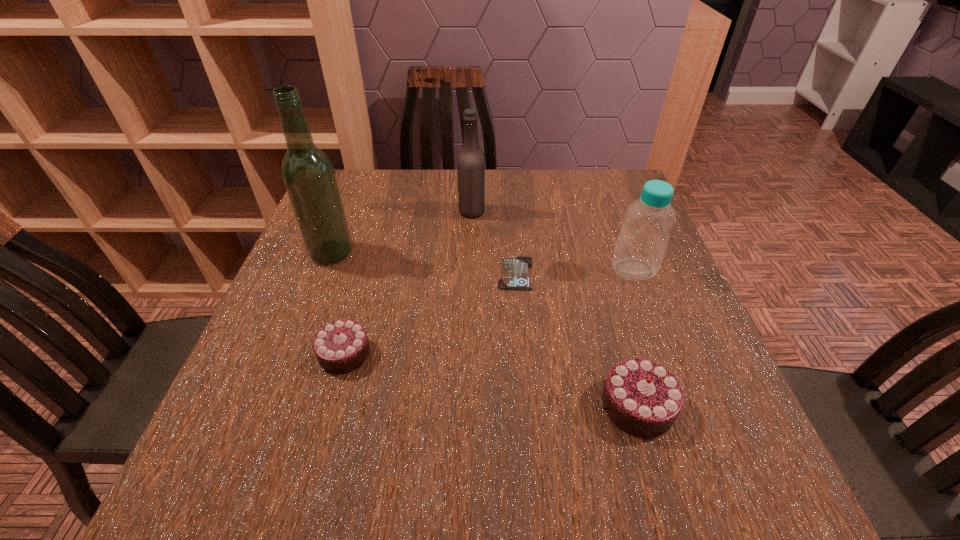
The width and height of the screenshot is (960, 540). I want to click on the shorter chocolate cake, so click(x=340, y=347).

You are a GUI agent. You are given a task and a screenshot of the screen. Output one action in this format:
    pyautogui.click(x=<x>, y=<y>)
    Task: Click on the farther chocolate cake
    This screenshot has width=960, height=540.
    Given the screenshot: What is the action you would take?
    pyautogui.click(x=340, y=347)

Where is `the right chocolate cake`? Image resolution: width=960 pixels, height=540 pixels. the right chocolate cake is located at coordinates coord(642,398).

Locate an element on the screen. This screenshot has width=960, height=540. the nearer chocolate cake is located at coordinates (642, 398).

The image size is (960, 540). I want to click on the second tallest object, so click(471, 162).

The width and height of the screenshot is (960, 540). I want to click on beer bottle, so click(x=471, y=162).

Where is `the fourth shortest object`? Image resolution: width=960 pixels, height=540 pixels. the fourth shortest object is located at coordinates (641, 244).

Find the location of a particular element. The height and width of the screenshot is (540, 960). the tallest object is located at coordinates (308, 174).

Find the location of a particular element. The width and height of the screenshot is (960, 540). the fourth object from left to right is located at coordinates (515, 272).

This screenshot has height=540, width=960. I want to click on the shortest object, so click(x=515, y=272).